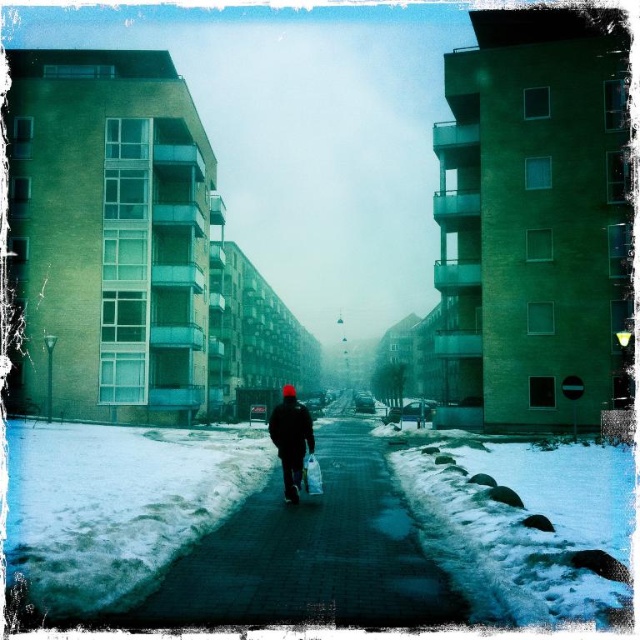
You are standing on the pathway and want to pick up the dark blue textured jacket at center. Is the smooth concrete pavement at center between you and the jacket?

Yes, the smooth concrete pavement at center is between you and the dark blue textured jacket at center because the pavement is closer to the viewer than the jacket.

You are a delivery person trying to place a package on the smooth concrete pavement at center. The package is the size of the dark blue textured jacket at center. Will it fit?

The smooth concrete pavement at center is bigger than the dark blue textured jacket at center, so the package will fit.